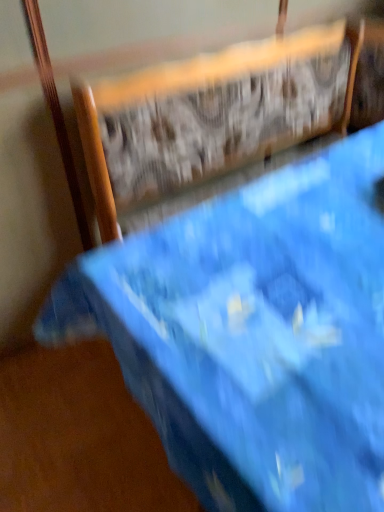
Image resolution: width=384 pixels, height=512 pixels. What do you see at coordinates (255, 334) in the screenshot? I see `blue fabric bed at upper center` at bounding box center [255, 334].

In order to click on blue fabric bed at upper center in this screenshot , I will do `click(255, 334)`.

What is the approximate width of blue fabric bed at upper center?

96.81 centimeters.

What do you see at coordinates (212, 122) in the screenshot? I see `blue fabric chair at upper center` at bounding box center [212, 122].

What is the approximate height of blue fabric chair at upper center?

86.29 centimeters.

Find the location of `blue fabric chair at upper center`. blue fabric chair at upper center is located at coordinates (212, 122).

You are a GUI agent. You are given a task and a screenshot of the screen. Output one action in this format:
    pyautogui.click(x=<x>, y=<y>)
    Task: Click on the blue fabric bed at upper center
    The width and height of the screenshot is (384, 512).
    Given the screenshot: What is the action you would take?
    pyautogui.click(x=255, y=334)

Which is more to the left, blue fabric chair at upper center or blue fabric bed at upper center?

From the viewer's perspective, blue fabric chair at upper center appears more on the left side.

Is blue fabric chair at upper center further to camera compared to blue fabric bed at upper center?

Yes, it is behind blue fabric bed at upper center.

Considering the points (193, 74) and (223, 401), which point is in front, point (193, 74) or point (223, 401)?

The point (223, 401) is more forward.

From the picture: From the image's perspective, which object appears higher, blue fabric chair at upper center or blue fabric bed at upper center?

blue fabric chair at upper center, from the image's perspective.

From a real-world perspective, is blue fabric chair at upper center physically located above or below blue fabric bed at upper center?

In terms of real-world spatial position, blue fabric chair at upper center is below blue fabric bed at upper center.

Considering the sizes of objects blue fabric chair at upper center and blue fabric bed at upper center in the image provided, who is thinner, blue fabric chair at upper center or blue fabric bed at upper center?

Thinner between the two is blue fabric chair at upper center.

Considering the relative sizes of blue fabric chair at upper center and blue fabric bed at upper center in the image provided, is blue fabric chair at upper center taller than blue fabric bed at upper center?

In fact, blue fabric chair at upper center may be shorter than blue fabric bed at upper center.

Can you confirm if blue fabric chair at upper center is smaller than blue fabric bed at upper center?

Yes, blue fabric chair at upper center is smaller than blue fabric bed at upper center.

Is blue fabric chair at upper center spatially inside blue fabric bed at upper center, or outside of it?

blue fabric chair at upper center exists entirely within blue fabric bed at upper center.

Is blue fabric chair at upper center with blue fabric bed at upper center?

No.

Based on the photo, does blue fabric chair at upper center turn towards blue fabric bed at upper center?

Yes, blue fabric chair at upper center faces towards blue fabric bed at upper center.

From the picture: What's the angular difference between blue fabric chair at upper center and blue fabric bed at upper center's facing directions?

The angle between the facing direction of blue fabric chair at upper center and the facing direction of blue fabric bed at upper center is 0.000355 degrees.

How much distance is there between blue fabric chair at upper center and blue fabric bed at upper center?

blue fabric chair at upper center is 22.60 inches from blue fabric bed at upper center.

Find the location of `chair behind the blue fabric bed at upper center`. chair behind the blue fabric bed at upper center is located at coordinates (212, 122).

Considering the relative positions of blue fabric bed at upper center and blue fabric chair at upper center in the image provided, is blue fabric bed at upper center to the right of blue fabric chair at upper center from the viewer's perspective?

Correct, you'll find blue fabric bed at upper center to the right of blue fabric chair at upper center.

Considering the relative positions of blue fabric bed at upper center and blue fabric chair at upper center in the image provided, is blue fabric bed at upper center in front of blue fabric chair at upper center?

That is True.

Considering the positions of point (140, 398) and point (171, 73), is point (140, 398) closer or farther from the camera than point (171, 73)?

Point (140, 398) is closer to the camera than point (171, 73).

From the image's perspective, between blue fabric bed at upper center and blue fabric chair at upper center, which one is located above?

blue fabric chair at upper center, from the image's perspective.

From a real-world perspective, is blue fabric bed at upper center over blue fabric chair at upper center?

Yes, from a real-world perspective, blue fabric bed at upper center is over blue fabric chair at upper center

Is blue fabric bed at upper center thinner than blue fabric chair at upper center?

No, blue fabric bed at upper center is not thinner than blue fabric chair at upper center.

Is blue fabric bed at upper center taller than blue fabric chair at upper center?

No, blue fabric bed at upper center is not taller than blue fabric chair at upper center.

Is blue fabric bed at upper center bigger or smaller than blue fabric chair at upper center?

Clearly, blue fabric bed at upper center is larger in size than blue fabric chair at upper center.

Is blue fabric bed at upper center not inside blue fabric chair at upper center?

No, blue fabric bed at upper center is inside or overlapping with blue fabric chair at upper center.

Is blue fabric bed at upper center with blue fabric chair at upper center?

blue fabric bed at upper center and blue fabric chair at upper center are clearly separated.

Is blue fabric bed at upper center aimed at blue fabric chair at upper center?

Yes, blue fabric bed at upper center is turned towards blue fabric chair at upper center.

The width and height of the screenshot is (384, 512). I want to click on chair on the left of blue fabric bed at upper center, so click(x=212, y=122).

The height and width of the screenshot is (512, 384). In order to click on chair directly beneath the blue fabric bed at upper center (from a real-world perspective) in this screenshot , I will do `click(212, 122)`.

The width and height of the screenshot is (384, 512). I want to click on furniture below the blue fabric chair at upper center (from the image's perspective), so click(x=255, y=334).